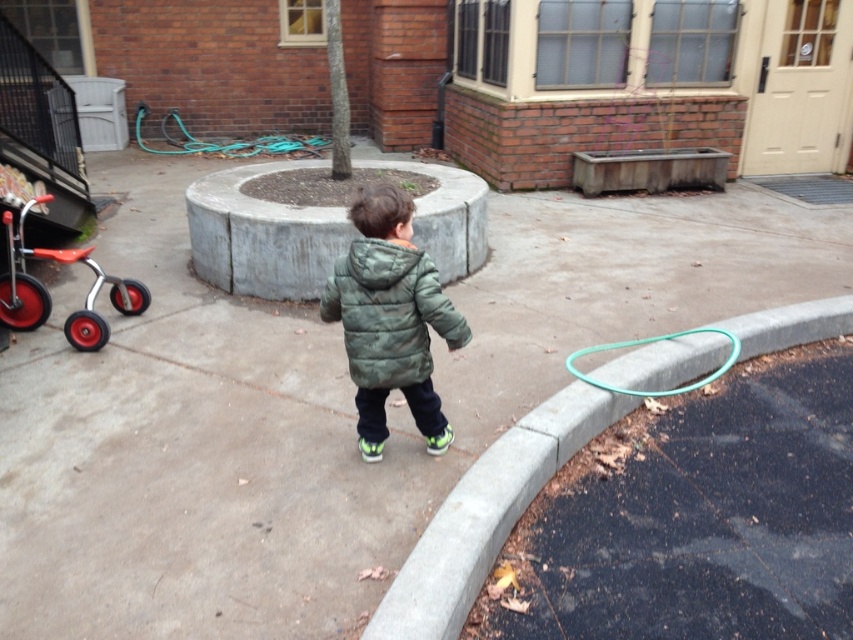
Which is in front, point (387, 324) or point (303, 140)?

Point (387, 324) is in front.

Which is behind, point (389, 372) or point (183, 141)?

Positioned behind is point (183, 141).

What do you see at coordinates (389, 312) in the screenshot? Image resolution: width=853 pixels, height=640 pixels. I see `green quilted jacket at center` at bounding box center [389, 312].

Locate an element on the screen. green quilted jacket at center is located at coordinates (389, 312).

Can you confirm if gray concrete curb at lower right is positioned to the right of red rubber baby carriage at left?

Correct, you'll find gray concrete curb at lower right to the right of red rubber baby carriage at left.

The height and width of the screenshot is (640, 853). I want to click on gray concrete curb at lower right, so click(486, 513).

Locate an element on the screen. This screenshot has height=640, width=853. gray concrete curb at lower right is located at coordinates (486, 513).

Is green quilted jacket at center bigger than red rubber baby carriage at left?

Incorrect, green quilted jacket at center is not larger than red rubber baby carriage at left.

Locate an element on the screen. This screenshot has width=853, height=640. green quilted jacket at center is located at coordinates (389, 312).